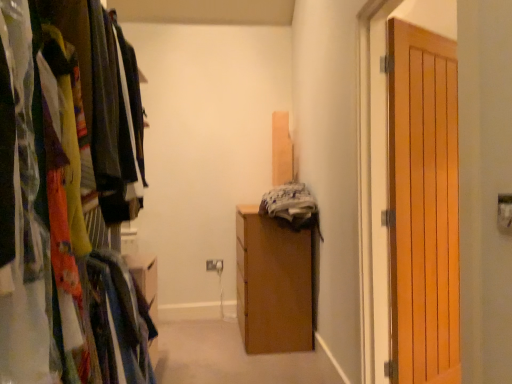
Question: Is wooden door at right wider or thinner than wooden cabinet at center?

Choices:
 (A) thin
 (B) wide

Answer: (A)

Question: Considering their positions, is wooden door at right located in front of or behind wooden cabinet at center?

Choices:
 (A) front
 (B) behind

Answer: (A)

Question: Considering the real-world distances, which object is closest to the wooden wardrobe at left?

Choices:
 (A) wooden door at right
 (B) wooden cabinet at center

Answer: (A)

Question: Based on their relative distances, which object is farther from the wooden cabinet at center?

Choices:
 (A) wooden wardrobe at left
 (B) wooden door at right

Answer: (A)